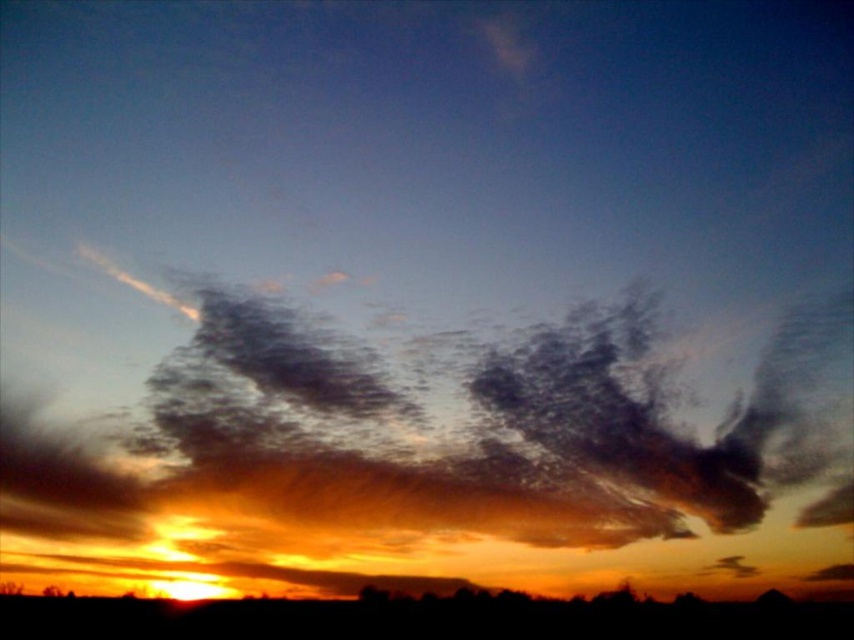
Question: Can you confirm if translucent orange cloud at center is positioned below golden-orange sky at center?

Choices:
 (A) yes
 (B) no

Answer: (B)

Question: Which point is farther from the camera taking this photo?

Choices:
 (A) (109, 605)
 (B) (349, 344)

Answer: (A)

Question: Which of the following is the closest to the observer?

Choices:
 (A) (560, 627)
 (B) (275, 582)

Answer: (B)

Question: Which point is farther to the camera?

Choices:
 (A) (589, 612)
 (B) (16, 557)

Answer: (A)

Question: Is translucent orange cloud at center smaller than golden-orange sky at center?

Choices:
 (A) no
 (B) yes

Answer: (A)

Question: Can you confirm if translucent orange cloud at center is positioned to the left of golden-orange sky at center?

Choices:
 (A) yes
 (B) no

Answer: (B)